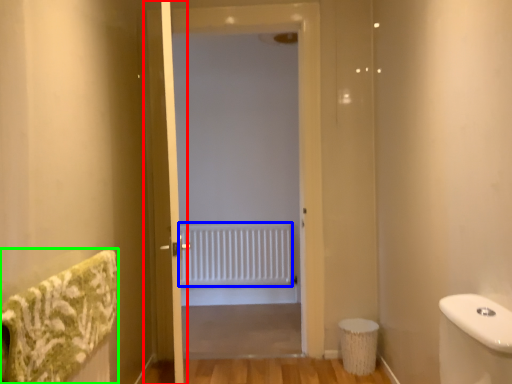
Question: Based on their relative distances, which object is nearer to screen door (highlighted by a red box)? Choose from radiator (highlighted by a blue box) and bath towel (highlighted by a green box).

Choices:
 (A) radiator
 (B) bath towel

Answer: (B)